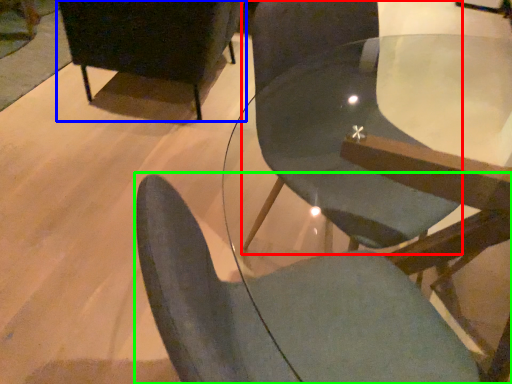
Question: Estimate the real-world distances between objects in this image. Which object is closer to chair (highlighted by a red box), chair (highlighted by a blue box) or chair (highlighted by a green box)?

Choices:
 (A) chair
 (B) chair

Answer: (B)